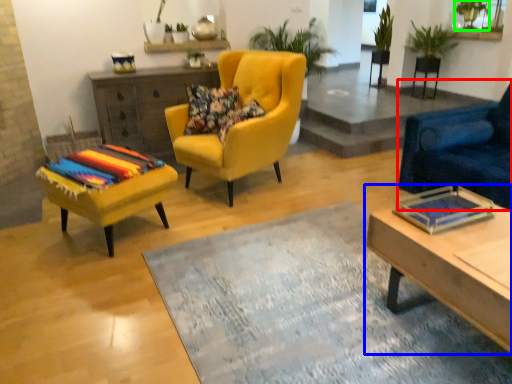
Question: Estimate the real-world distances between objects in this image. Which object is farther from chair (highlighted by a red box), coffee table (highlighted by a blue box) or plant (highlighted by a green box)?

Choices:
 (A) coffee table
 (B) plant

Answer: (B)